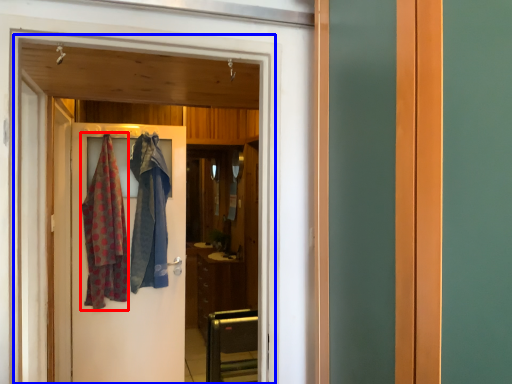
Question: Which of the following is the closest to the observer, clothing (highlighted by a red box) or elevator (highlighted by a blue box)?

Choices:
 (A) clothing
 (B) elevator

Answer: (B)